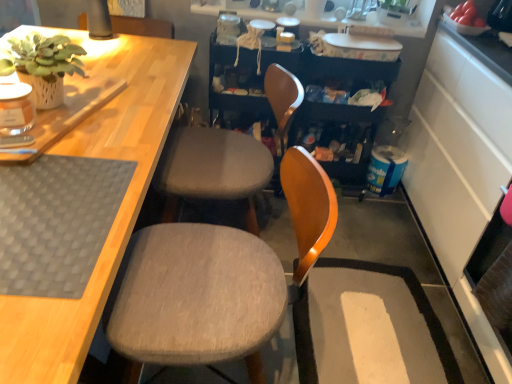
Question: From their relative heights in the image, would you say textured gray cushion at center, the first chair when ordered from back to front, is taller or shorter than gray fabric chair at center, the first chair in the front-to-back sequence?

Choices:
 (A) tall
 (B) short

Answer: (A)

Question: From a real-world perspective, relative to gray fabric chair at center, which ranks as the 2th chair in back-to-front order, is textured gray cushion at center, the 2th chair positioned from the front, vertically above or below?

Choices:
 (A) above
 (B) below

Answer: (A)

Question: Estimate the real-world distances between objects in this image. Which object is closer to the green matte plant at upper left?

Choices:
 (A) gray woven mat at lower left
 (B) white glossy shelves at upper center
 (C) textured gray cushion at center, the 2th chair positioned from the front
 (D) gray fabric chair at center, the first chair in the front-to-back sequence
 (E) white textured rug at lower right

Answer: (A)

Question: Which object is positioned closest to the green matte plant at upper left?

Choices:
 (A) white glossy shelves at upper center
 (B) textured gray cushion at center, the first chair when ordered from back to front
 (C) gray woven mat at lower left
 (D) gray fabric chair at center, the first chair in the front-to-back sequence
 (E) white textured rug at lower right

Answer: (C)